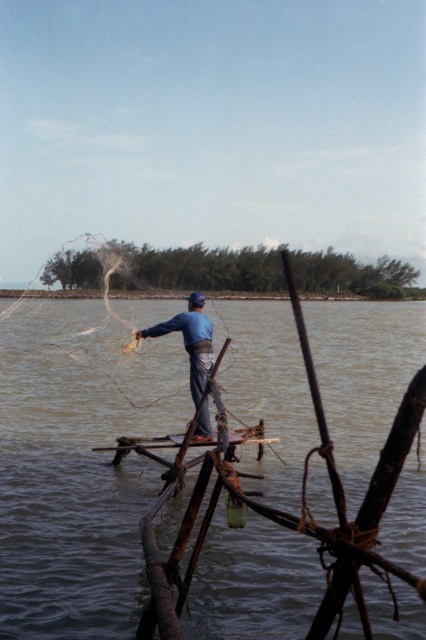
You are a drone operator trying to capture a photo of the blue fabric fisherman at center and the brown muddy water at center. Which object occupies a bigger area in the image?

The brown muddy water at center is larger in size than the blue fabric fisherman at center, so it occupies a bigger area in the image.

You are a drone operator trying to capture a photo of the blue fabric fisherman at center and the brown muddy water at center. The camera has a maximum focus range of 20 meters. Will both subjects be in focus if you take the photo from your current position?

The brown muddy water at center and blue fabric fisherman at center are 22.45 meters apart from each other. Since the camera can only focus up to 20 meters, both subjects cannot be in focus simultaneously.

You are a drone operator trying to capture a photo of the blue fabric fisherman at center and the brown muddy water at center. From your aerial view, which one is positioned higher in the image?

The brown muddy water at center is above the blue fabric fisherman at center, so it is positioned higher in the image.